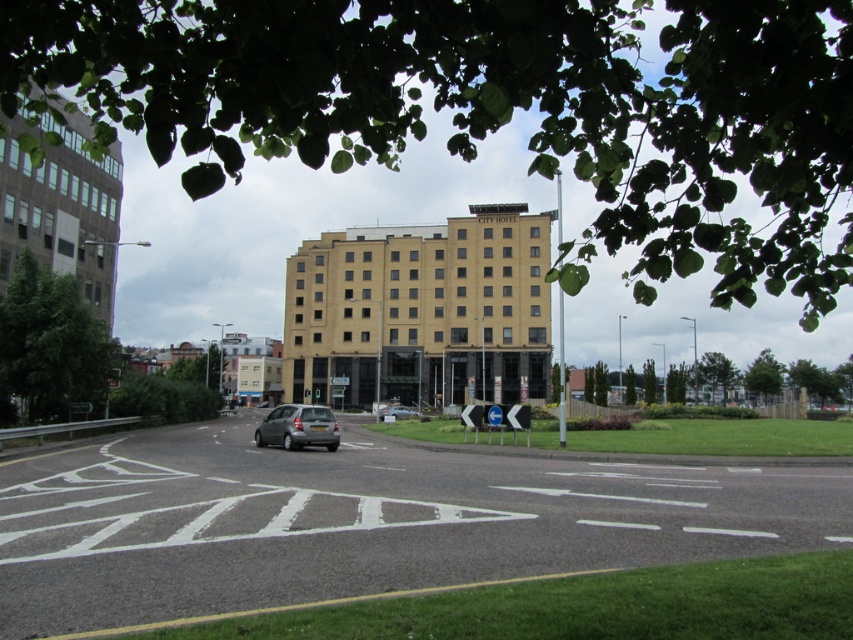
You are a pedestrian standing on the sidewalk near the road. You see the glassy reflective building at left and the silver metallic car at center. Which object is closer to you?

The silver metallic car at center is closer to you because the glassy reflective building at left is positioned over it, indicating the car is in front.

You are a driver approaching the CITY HOTEL and need to park your car. You see the yellow brick building at center and the silver metallic hatchback at center. Which object is larger and would require more space to accommodate?

The yellow brick building at center is bigger than the silver metallic hatchback at center, so it requires more space to accommodate.